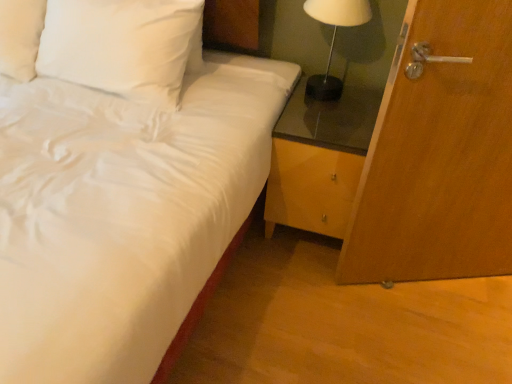
Locate an element on the screen. The width and height of the screenshot is (512, 384). white glossy table lamp at upper right is located at coordinates (333, 39).

What is the approximate height of white satin bed at center?

white satin bed at center is 27.80 inches tall.

You are a GUI agent. You are given a task and a screenshot of the screen. Output one action in this format:
    pyautogui.click(x=<x>, y=<y>)
    Task: Click on the white satin pillow at upper left
    Image resolution: width=512 pixels, height=384 pixels.
    Given the screenshot: What is the action you would take?
    pyautogui.click(x=122, y=45)

In order to face wooden door at right, should I rotate leftwards or rightwards?

You should look right and rotate roughly 28.195 degrees.

You are a GUI agent. You are given a task and a screenshot of the screen. Output one action in this format:
    pyautogui.click(x=<x>, y=<y>)
    Task: Click on the white glossy table lamp at upper right
    The height and width of the screenshot is (384, 512).
    Given the screenshot: What is the action you would take?
    pyautogui.click(x=333, y=39)

Does point (444, 166) come behind point (164, 68)?

No, it is not.

Can you confirm if wooden door at right is taller than white satin pillow at upper left?

Indeed, wooden door at right has a greater height compared to white satin pillow at upper left.

Which object is further away from the camera, wooden door at right or white satin pillow at upper left?

Positioned behind is white satin pillow at upper left.

Is wooden door at right wider than white satin pillow at upper left?

Incorrect, the width of wooden door at right does not surpass that of white satin pillow at upper left.

From the image's perspective, which one is positioned lower, white satin bed at center or white glossy table lamp at upper right?

From the image's view, white satin bed at center is below.

You are a GUI agent. You are given a task and a screenshot of the screen. Output one action in this format:
    pyautogui.click(x=<x>, y=<y>)
    Task: Click on the bed in front of the white glossy table lamp at upper right
    The height and width of the screenshot is (384, 512).
    Given the screenshot: What is the action you would take?
    pyautogui.click(x=119, y=179)

Are white satin bed at center and white glossy table lamp at upper right making contact?

No, white satin bed at center is not touching white glossy table lamp at upper right.

Between white glossy table lamp at upper right and white satin bed at center, which one has larger width?

With larger width is white satin bed at center.

Which of these two, white glossy table lamp at upper right or white satin bed at center, stands shorter?

white glossy table lamp at upper right.

Could you tell me if white glossy table lamp at upper right is facing white satin bed at center?

No.

In the scene shown: Who is smaller, white glossy table lamp at upper right or white satin bed at center?

With smaller size is white glossy table lamp at upper right.

Who is smaller, white glossy table lamp at upper right or wooden door at right?

With smaller size is white glossy table lamp at upper right.

Is white glossy table lamp at upper right directly adjacent to wooden door at right?

No.

Is white glossy table lamp at upper right oriented away from wooden door at right?

No, white glossy table lamp at upper right is not facing the opposite direction of wooden door at right.

Does white satin pillow at upper left have a lesser height compared to white satin bed at center?

Correct, white satin pillow at upper left is not as tall as white satin bed at center.

How different are the orientations of white satin pillow at upper left and white satin bed at center in degrees?

The angular difference between white satin pillow at upper left and white satin bed at center is 3.56 degrees.

Would you consider white satin pillow at upper left to be distant from white satin bed at center?

They are positioned close to each other.

Considering the sizes of white satin pillow at upper left and white satin bed at center in the image, is white satin pillow at upper left bigger or smaller than white satin bed at center?

Considering their sizes, white satin pillow at upper left takes up less space than white satin bed at center.

Between white satin bed at center and white satin pillow at upper left, which one appears on the right side from the viewer's perspective?

white satin pillow at upper left.

Looking at this image, who is taller, white satin bed at center or white satin pillow at upper left?

white satin bed at center.

This screenshot has height=384, width=512. Find the location of `pillow on the left of white glossy table lamp at upper right`. pillow on the left of white glossy table lamp at upper right is located at coordinates (122, 45).

Would you say white glossy table lamp at upper right is part of white satin pillow at upper left's contents?

No, white satin pillow at upper left does not contain white glossy table lamp at upper right.

Considering the relative positions of white satin pillow at upper left and white glossy table lamp at upper right in the image provided, is white satin pillow at upper left behind white glossy table lamp at upper right?

No.

Which of these two, white satin pillow at upper left or white glossy table lamp at upper right, stands taller?

white satin pillow at upper left is taller.

Find the location of a particular element. Image resolution: width=512 pixels, height=384 pixels. door in front of the white satin pillow at upper left is located at coordinates (439, 154).

In the image, there is a white glossy table lamp at upper right. At what (x,y) coordinates should I click in order to perform the action: click on bed below it (from a real-world perspective). Please return your answer as a coordinate pair (x, y). Looking at the image, I should click on (119, 179).

When comparing their distances from white glossy table lamp at upper right, does white satin pillow at upper left or white satin bed at center seem further?

white satin bed at center.

From the image, which object appears to be nearer to white satin pillow at upper left, white satin bed at center or wooden door at right?

Among the two, white satin bed at center is located nearer to white satin pillow at upper left.

When comparing their distances from white satin bed at center, does white glossy table lamp at upper right or white satin pillow at upper left seem closer?

The object closer to white satin bed at center is white satin pillow at upper left.

Looking at the image, which one is located further to white satin pillow at upper left, wooden door at right or white satin bed at center?

The object further to white satin pillow at upper left is wooden door at right.

Estimate the real-world distances between objects in this image. Which object is closer to white satin bed at center, white satin pillow at upper left or wooden door at right?

Based on the image, white satin pillow at upper left appears to be nearer to white satin bed at center.

Based on their spatial positions, is white glossy table lamp at upper right or white satin pillow at upper left further from wooden door at right?

white satin pillow at upper left.

From the image, which object appears to be nearer to white satin bed at center, white glossy table lamp at upper right or wooden door at right?

The object closer to white satin bed at center is white glossy table lamp at upper right.

Based on their spatial positions, is white satin pillow at upper left or white glossy table lamp at upper right further from wooden door at right?

white satin pillow at upper left lies further to wooden door at right than the other object.

This screenshot has width=512, height=384. I want to click on table lamp between white satin bed at center and wooden door at right in the horizontal direction, so click(x=333, y=39).

At what (x,y) coordinates should I click in order to perform the action: click on table lamp situated between white satin pillow at upper left and wooden door at right from left to right. Please return your answer as a coordinate pair (x, y). The height and width of the screenshot is (384, 512). Looking at the image, I should click on (333, 39).

Locate an element on the screen. Image resolution: width=512 pixels, height=384 pixels. pillow situated between white satin bed at center and white glossy table lamp at upper right from left to right is located at coordinates (122, 45).

Image resolution: width=512 pixels, height=384 pixels. Identify the location of pillow between white satin bed at center and wooden door at right from left to right. (122, 45).